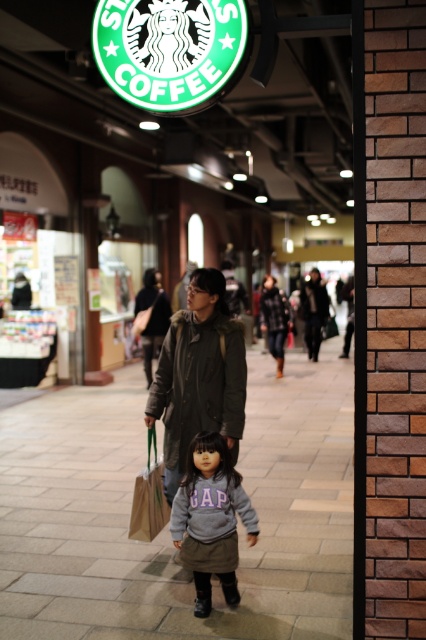
Question: Estimate the real-world distances between objects in this image. Which object is farther from the gray fleece sweatshirt at center?

Choices:
 (A) black wool coat at center
 (B) dark green fabric jacket at center
 (C) dark green textured coat at center

Answer: (C)

Question: From the image, what is the correct spatial relationship of dark gray wool coat at center in relation to gray fleece sweatshirt at center?

Choices:
 (A) left
 (B) right

Answer: (A)

Question: Does gray fleece hoodie at center appear on the left side of dark green fabric jacket at center?

Choices:
 (A) yes
 (B) no

Answer: (B)

Question: Is dark gray wool coat at center bigger than black wool coat at center?

Choices:
 (A) yes
 (B) no

Answer: (B)

Question: Which of these objects is positioned closest to the dark green fabric jacket at center?

Choices:
 (A) dark green textured coat at center
 (B) gray fleece sweatshirt at center
 (C) dark gray wool coat at center

Answer: (B)

Question: Which object is positioned farthest from the dark green fabric jacket at center?

Choices:
 (A) gray fleece hoodie at center
 (B) smooth concrete pavement at center

Answer: (A)